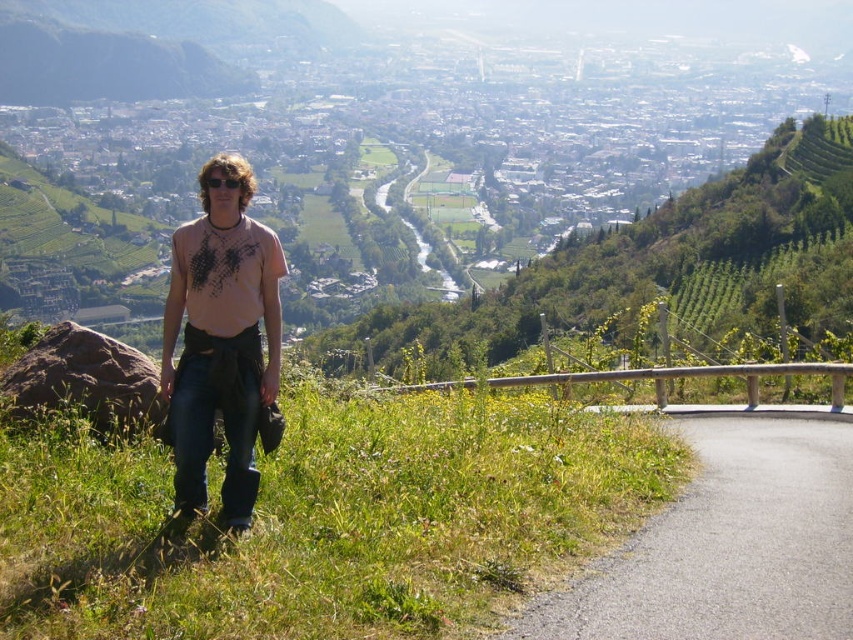
From the picture: Can you confirm if green grassy at center is taller than asphalt road at lower right?

Correct, green grassy at center is much taller as asphalt road at lower right.

Identify the location of green grassy at center. (323, 518).

In the scene shown: Between green grassy at center and ripped denim jeans at lower left, which one appears on the left side from the viewer's perspective?

ripped denim jeans at lower left is more to the left.

Based on the photo, is green grassy at center to the right of ripped denim jeans at lower left from the viewer's perspective?

Correct, you'll find green grassy at center to the right of ripped denim jeans at lower left.

Is point (32, 557) positioned before point (273, 346)?

That is True.

Locate an element on the screen. green grassy at center is located at coordinates (323, 518).

Is asphalt road at lower right positioned behind ripped denim jeans at lower left?

No, it is in front of ripped denim jeans at lower left.

I want to click on asphalt road at lower right, so click(728, 541).